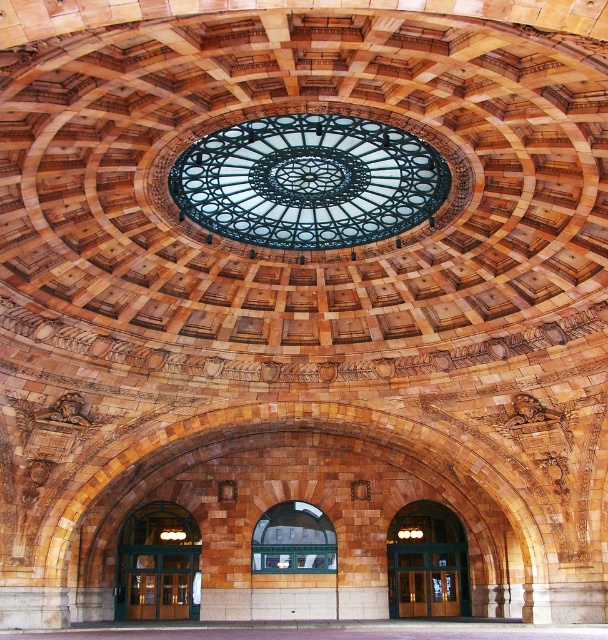
Which is above, green glass doors at center or clear glass window at center?

clear glass window at center is above.

I want to click on green glass doors at center, so click(159, 564).

This screenshot has height=640, width=608. In order to click on green glass doors at center in this screenshot , I will do `click(159, 564)`.

Does green glass doors at center appear under green glass door at center?

Incorrect, green glass doors at center is not positioned below green glass door at center.

The height and width of the screenshot is (640, 608). Describe the element at coordinates (159, 564) in the screenshot. I see `green glass doors at center` at that location.

Does point (199, 552) come closer to viewer compared to point (399, 588)?

Yes, point (199, 552) is in front of point (399, 588).

The width and height of the screenshot is (608, 640). Find the location of `green glass doors at center`. green glass doors at center is located at coordinates (159, 564).

Can you confirm if clear glass dome at center is positioned above green glass door at center?

Correct, clear glass dome at center is located above green glass door at center.

Is clear glass dome at center wider than green glass door at center?

Yes.

Where is `clear glass dome at center`? The width and height of the screenshot is (608, 640). clear glass dome at center is located at coordinates (309, 180).